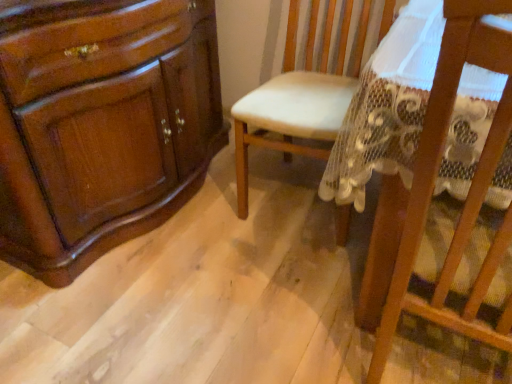
Locate an element on the screen. This screenshot has height=384, width=512. blank space to the left of wooden chair at center, the 2th chair from the back is located at coordinates (267, 317).